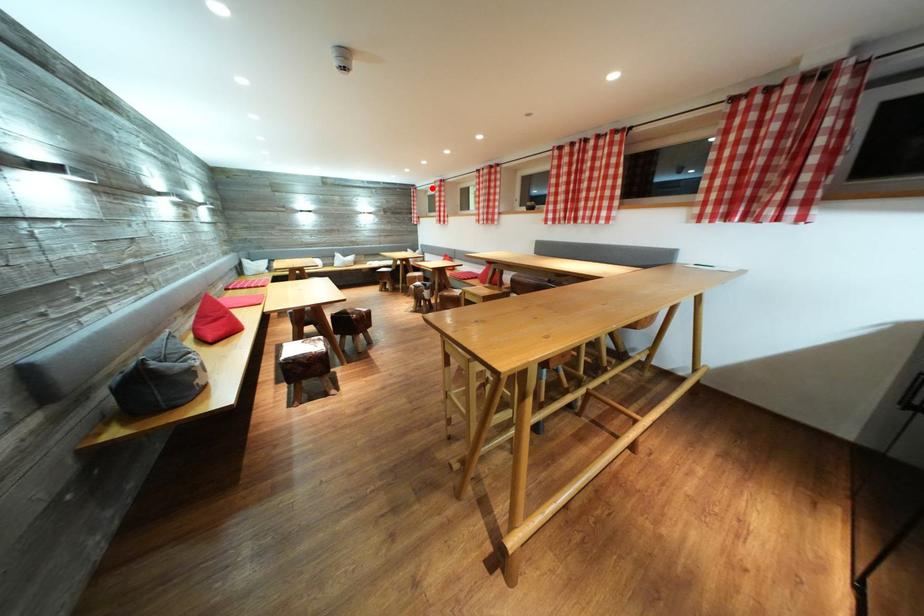
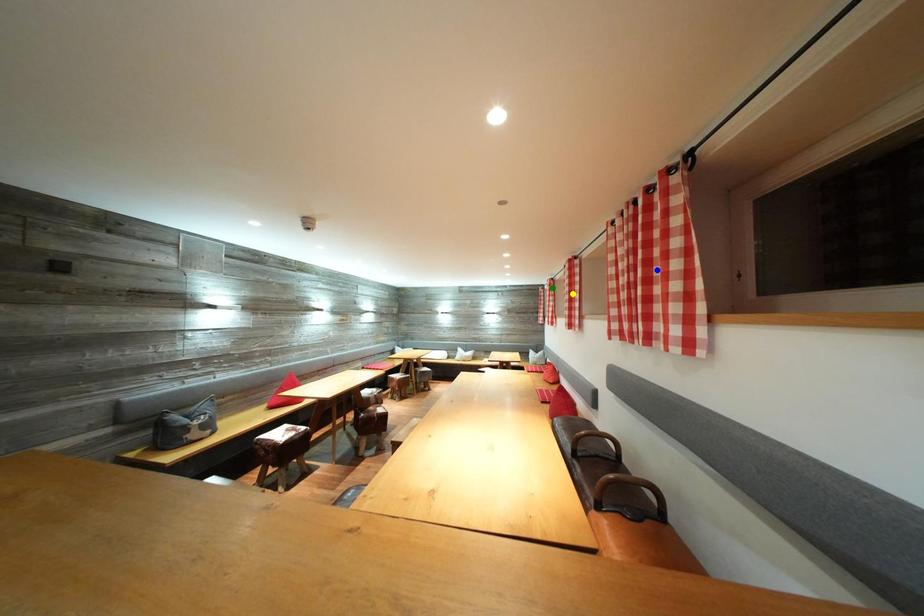
Question: I am providing you with two images of the same scene from different viewpoints. A red point is marked on the first image. You are given multiple points on the second image. Which spot in image 2 lines up with the point in image 1?

Choices:
 (A) green point
 (B) blue point
 (C) yellow point

Answer: (A)